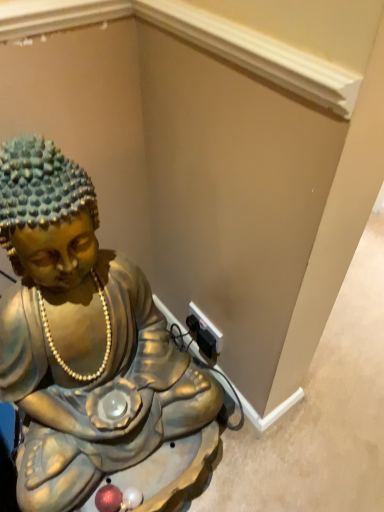
Locate an element on the screen. This screenshot has width=384, height=512. gold metallic statue at lower left is located at coordinates [84, 341].

Describe the element at coordinates (84, 341) in the screenshot. This screenshot has height=512, width=384. I see `gold metallic statue at lower left` at that location.

Locate an element on the screen. This screenshot has width=384, height=512. gold metallic statue at lower left is located at coordinates (84, 341).